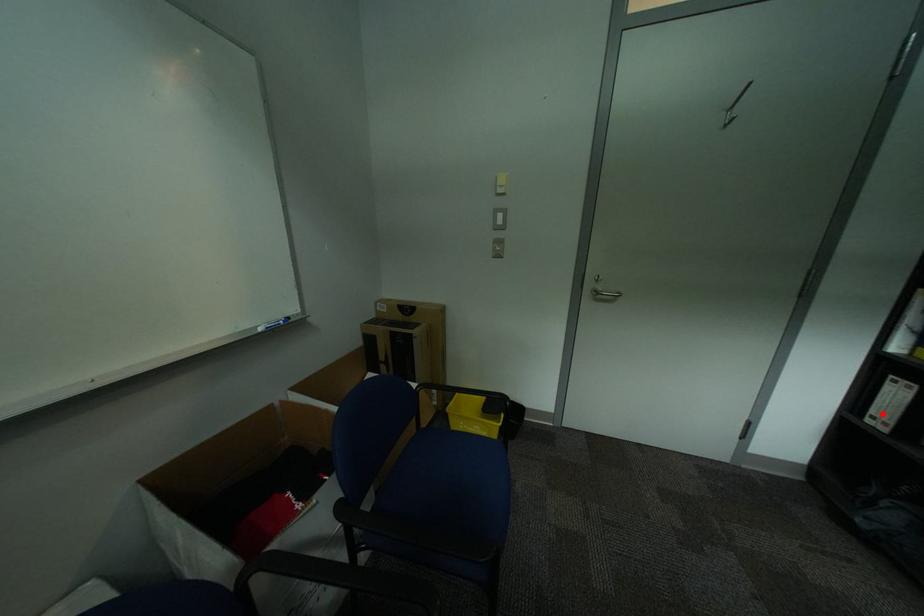
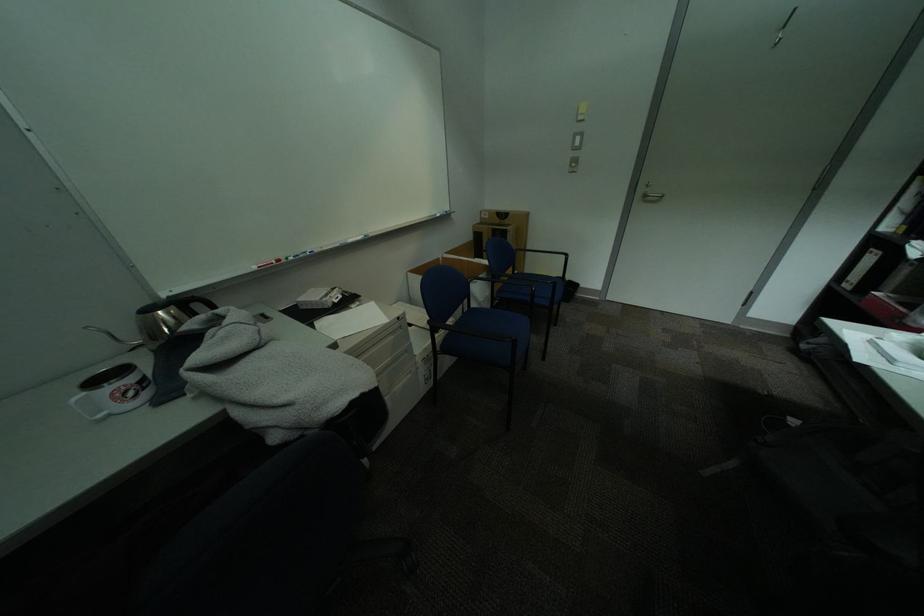
Where in the second image is the point corresponding to the highlighted location from the first image?

(859, 280)